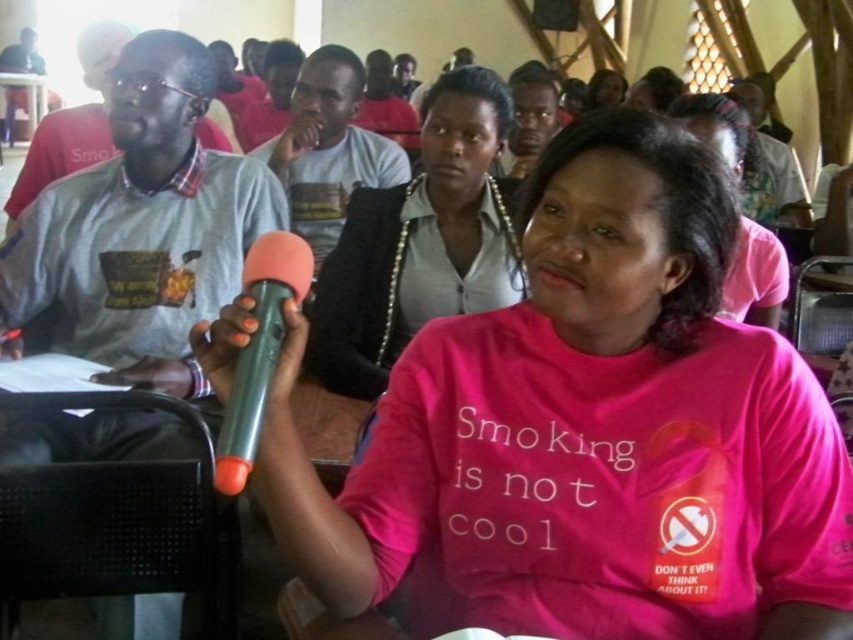
Which of these two, white glossy shirt at center or matte white shirt at center, stands taller?

Standing taller between the two is matte white shirt at center.

Which is more to the right, white glossy shirt at center or matte white shirt at center?

From the viewer's perspective, white glossy shirt at center appears more on the right side.

The height and width of the screenshot is (640, 853). Describe the element at coordinates (421, 241) in the screenshot. I see `white glossy shirt at center` at that location.

You are a GUI agent. You are given a task and a screenshot of the screen. Output one action in this format:
    pyautogui.click(x=<x>, y=<y>)
    Task: Click on the white glossy shirt at center
    Image resolution: width=853 pixels, height=640 pixels.
    Given the screenshot: What is the action you would take?
    pyautogui.click(x=421, y=241)

Is pink matte shirt at center closer to camera compared to white glossy shirt at center?

Yes, it is.

In the scene shown: Is pink matte shirt at center above white glossy shirt at center?

No, pink matte shirt at center is not above white glossy shirt at center.

Who is more forward, [466,436] or [496,193]?

Point [466,436] is more forward.

Find the location of a particular element. The image size is (853, 640). pink matte shirt at center is located at coordinates (589, 433).

Between point (267, 278) and point (590, 109), which one is positioned in front?

Positioned in front is point (267, 278).

Is orange matte microphone at center to the left of matte black hair at upper center from the viewer's perspective?

Correct, you'll find orange matte microphone at center to the left of matte black hair at upper center.

Does point (292, 262) lie behind point (619, 93)?

No.

The width and height of the screenshot is (853, 640). What are the coordinates of `orange matte microphone at center` in the screenshot? It's located at (259, 349).